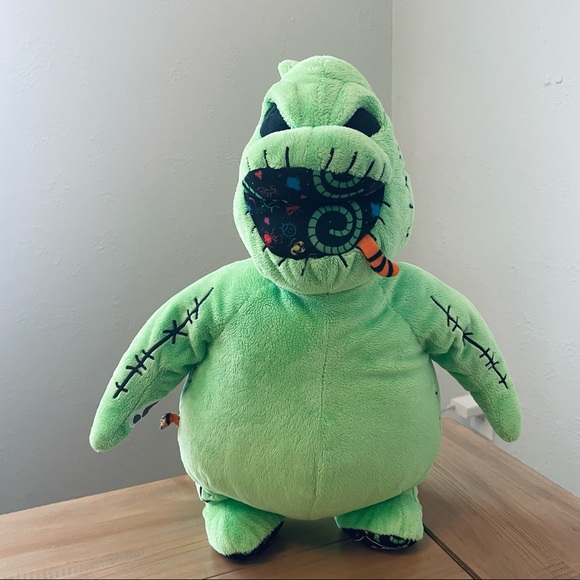
I want to click on back table, so click(x=77, y=554).